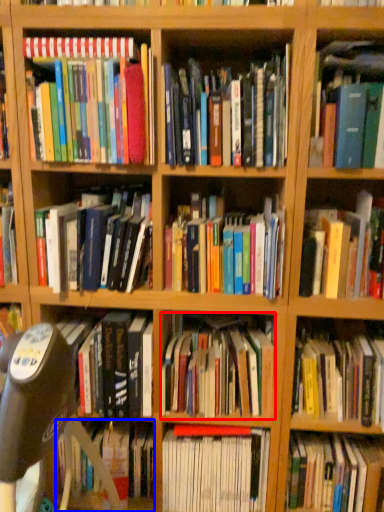
Question: Which of the following is the closest to the observer, book (highlighted by a red box) or book (highlighted by a blue box)?

Choices:
 (A) book
 (B) book

Answer: (A)